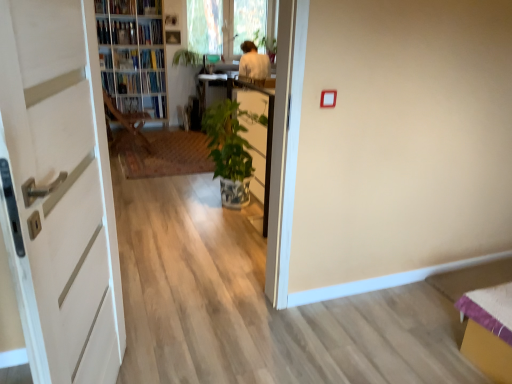
Question: Does hardcover book at center, which ranks as the 1th book in right-to-left order, have a lesser width compared to hardcover book at upper left, the 2th book viewed from the right?

Choices:
 (A) no
 (B) yes

Answer: (B)

Question: Is hardcover book at center, which ranks as the 1th book in right-to-left order, closer to the viewer compared to hardcover book at upper left, the 3th book from the left?

Choices:
 (A) yes
 (B) no

Answer: (B)

Question: Is there a large distance between hardcover book at center, the fourth book from the left, and hardcover book at upper left, the 3th book from the left?

Choices:
 (A) yes
 (B) no

Answer: (B)

Question: Is hardcover book at center, which ranks as the 1th book in right-to-left order, positioned behind hardcover book at upper left, the 3th book from the left?

Choices:
 (A) no
 (B) yes

Answer: (B)

Question: From a real-world perspective, is hardcover book at center, which ranks as the 1th book in right-to-left order, physically above hardcover book at upper left, the 3th book from the left?

Choices:
 (A) yes
 (B) no

Answer: (B)

Question: Can you confirm if hardcover book at center, the fourth book from the left, is positioned to the right of hardcover book at upper left, the 3th book from the left?

Choices:
 (A) no
 (B) yes

Answer: (B)

Question: Considering the relative sizes of wooden bookshelf at upper left and green glazed pot at center in the image provided, is wooden bookshelf at upper left wider than green glazed pot at center?

Choices:
 (A) yes
 (B) no

Answer: (A)

Question: Is wooden bookshelf at upper left closer to camera compared to green glazed pot at center?

Choices:
 (A) yes
 (B) no

Answer: (B)

Question: Is wooden bookshelf at upper left next to green glazed pot at center?

Choices:
 (A) yes
 (B) no

Answer: (B)

Question: Can we say wooden bookshelf at upper left lies outside green glazed pot at center?

Choices:
 (A) no
 (B) yes

Answer: (B)

Question: Considering the relative positions of wooden bookshelf at upper left and green glazed pot at center in the image provided, is wooden bookshelf at upper left to the left of green glazed pot at center from the viewer's perspective?

Choices:
 (A) yes
 (B) no

Answer: (A)

Question: Considering the relative sizes of wooden bookshelf at upper left and green glazed pot at center in the image provided, is wooden bookshelf at upper left shorter than green glazed pot at center?

Choices:
 (A) no
 (B) yes

Answer: (A)

Question: Can you confirm if wooden bookshelf at upper left is wider than hardcover book at upper left, which ranks as the third book in right-to-left order?

Choices:
 (A) yes
 (B) no

Answer: (A)